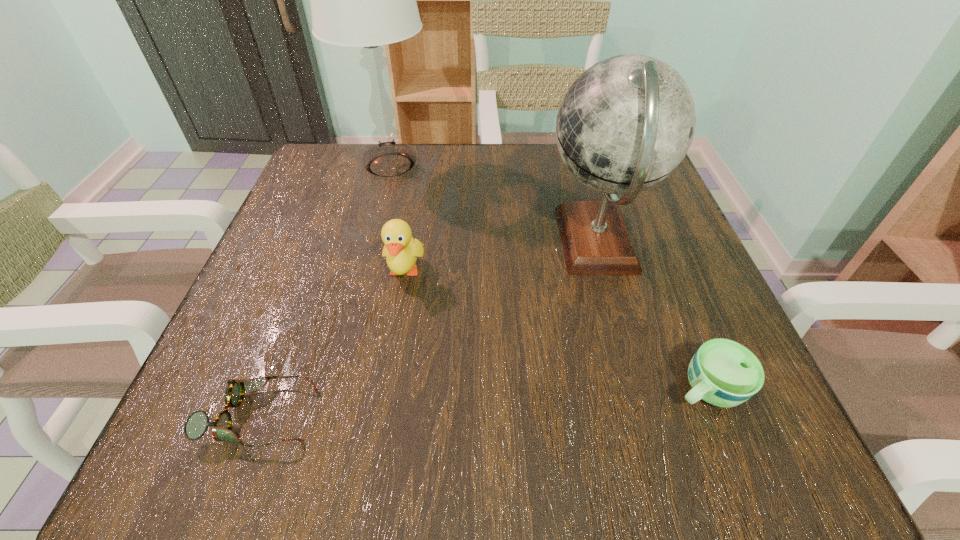
Find the location of a particular element. blank area in the image that satisfies the following two spatial constraints: 1. on the back side of the fourth tallest object; 2. on the front-facing side of the tallest object is located at coordinates (617, 165).

Locate an element on the screen. vacant space that satisfies the following two spatial constraints: 1. on the front-facing side of the duckling; 2. on the front-facing side of the shortest object is located at coordinates (380, 416).

Locate an element on the screen. This screenshot has height=540, width=960. vacant region that satisfies the following two spatial constraints: 1. at the equator of the fourth shortest object; 2. on the front-facing side of the duckling is located at coordinates (605, 272).

Find the location of a particular element. This screenshot has width=960, height=540. vacant space that satisfies the following two spatial constraints: 1. at the equator of the fourth shortest object; 2. on the front-facing side of the duckling is located at coordinates (605, 272).